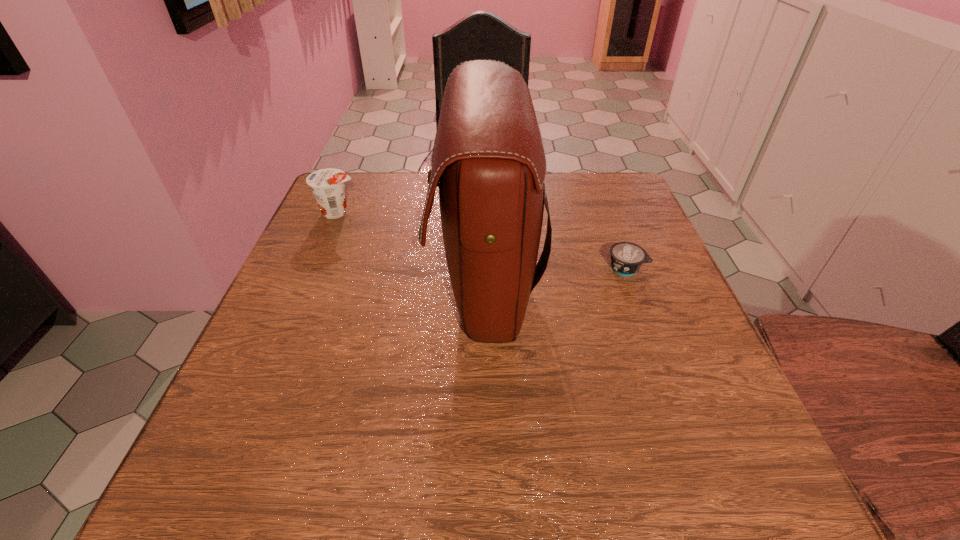
The width and height of the screenshot is (960, 540). What are the coordinates of `satchel` in the screenshot? It's located at coord(488,160).

You are a GUI agent. You are given a task and a screenshot of the screen. Output one action in this format:
    pyautogui.click(x=<x>, y=<y>)
    Task: Click on the second object from left to right
    This screenshot has width=960, height=540.
    Given the screenshot: What is the action you would take?
    pyautogui.click(x=488, y=160)

This screenshot has height=540, width=960. In order to click on the second tallest object in this screenshot , I will do `click(327, 185)`.

Where is `the left yogurt`? The width and height of the screenshot is (960, 540). the left yogurt is located at coordinates [x=327, y=185].

Find the location of a particular element. The image size is (960, 540). the rightmost object is located at coordinates (626, 258).

You are a GUI agent. You are given a task and a screenshot of the screen. Output one action in this format:
    pyautogui.click(x=<x>, y=<y>)
    Task: Click on the nearer yogurt
    This screenshot has height=540, width=960.
    Given the screenshot: What is the action you would take?
    pyautogui.click(x=626, y=258)

Locate an element on the screen. This screenshot has width=960, height=540. vacant area located on the open flap of the satchel is located at coordinates (291, 284).

Where is `vacant area located 0.060m on the open flap of the satchel`? The width and height of the screenshot is (960, 540). vacant area located 0.060m on the open flap of the satchel is located at coordinates (404, 284).

Find the location of `free point located on the open flap of the satchel`. free point located on the open flap of the satchel is located at coordinates [x=384, y=284].

Image resolution: width=960 pixels, height=540 pixels. What are the coordinates of `free space located 0.120m on the right of the farther yogurt` in the screenshot? It's located at (407, 212).